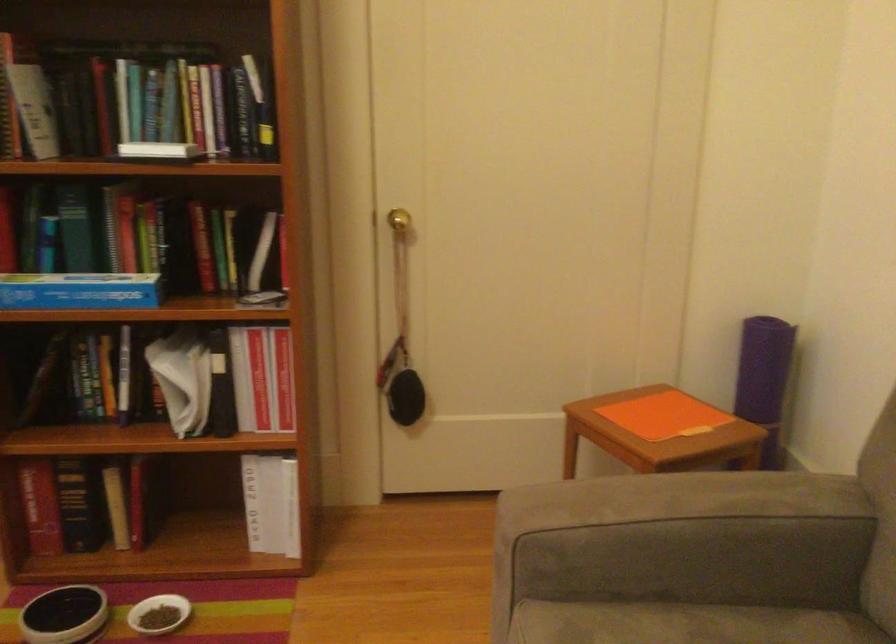
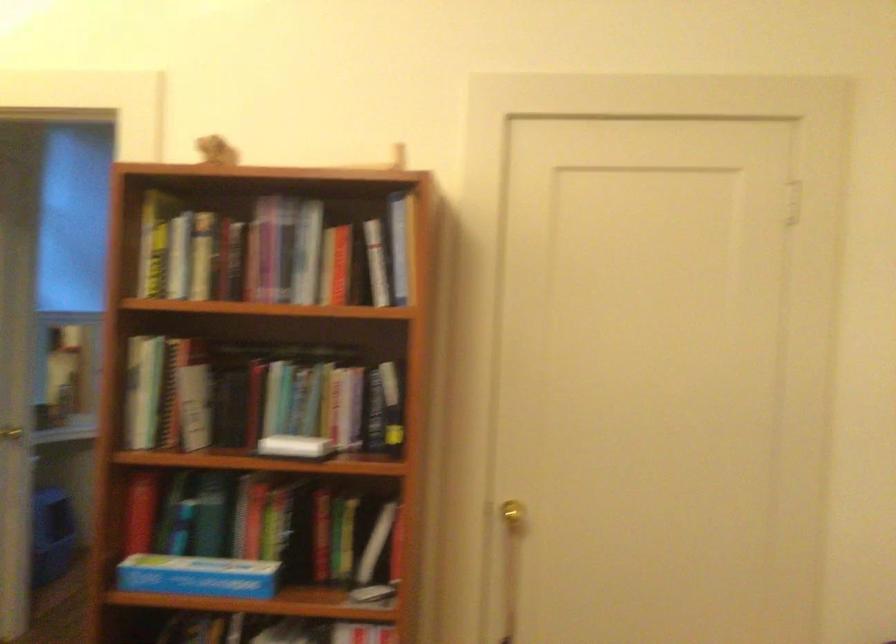
Where in the second image is the point corresponding to point 73,230 from the first image?

(208, 514)